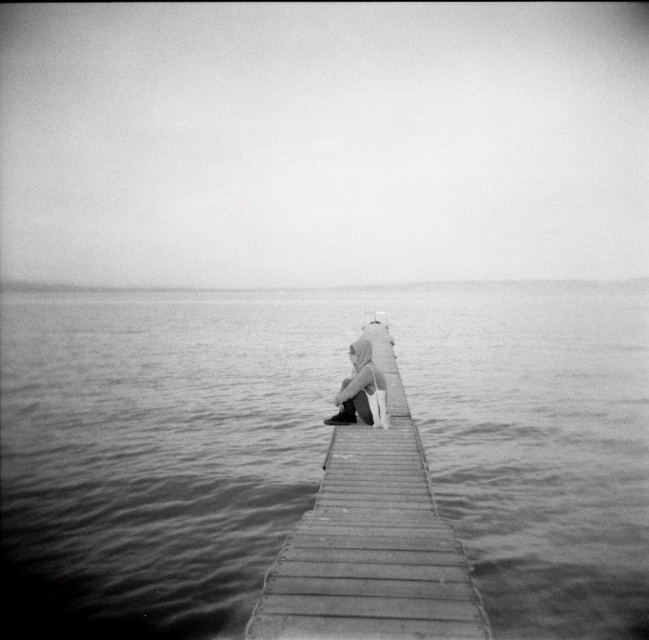
Can you confirm if smooth water at center is thinner than wooden dock at center?

Incorrect, smooth water at center's width is not less than wooden dock at center's.

Can you confirm if smooth water at center is positioned below wooden dock at center?

Actually, smooth water at center is above wooden dock at center.

Who is more forward, [576,310] or [435,600]?

Positioned in front is point [435,600].

Where is `smooth water at center`? smooth water at center is located at coordinates (315, 449).

Can you confirm if smooth water at center is smaller than light gray fabric pants at center?

Actually, smooth water at center might be larger than light gray fabric pants at center.

Does smooth water at center have a greater height compared to light gray fabric pants at center?

Yes.

Does point (197, 476) lie behind point (339, 400)?

Yes, point (197, 476) is behind point (339, 400).

Identify the location of smooth water at center. (315, 449).

Between wooden dock at center and light gray fabric pants at center, which one is positioned higher?

light gray fabric pants at center is higher up.

Who is positioned more to the right, wooden dock at center or light gray fabric pants at center?

From the viewer's perspective, wooden dock at center appears more on the right side.

This screenshot has height=640, width=649. Identify the location of wooden dock at center. (371, 529).